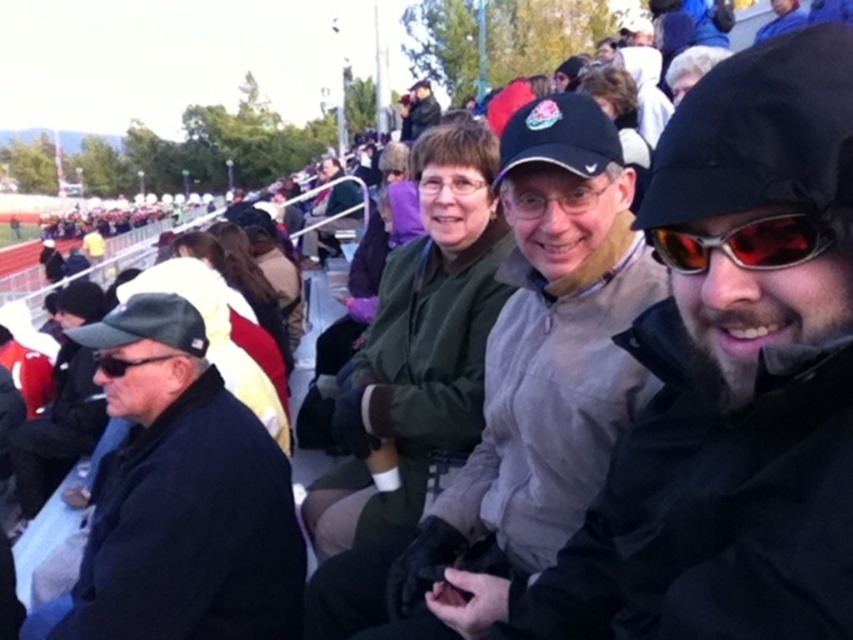
Question: Among these objects, which one is farthest from the camera?

Choices:
 (A) gray fleece jacket at center
 (B) shiny metallic goggles at center
 (C) black matte jacket at left
 (D) matte black glasses at center

Answer: (A)

Question: Can you confirm if gray fleece jacket at center is positioned to the right of black matte jacket at left?

Choices:
 (A) no
 (B) yes

Answer: (B)

Question: Is gray knit hat at center thinner than black matte sunglasses at left?

Choices:
 (A) yes
 (B) no

Answer: (B)

Question: Considering the real-world distances, which object is farthest from the gray knit hat at center?

Choices:
 (A) black matte jacket at left
 (B) gray fleece jacket at center
 (C) shiny metallic goggles at center

Answer: (B)

Question: Can you confirm if gray fleece jacket at center is positioned below matte black glasses at center?

Choices:
 (A) yes
 (B) no

Answer: (A)

Question: Which of these objects is positioned farthest from the matte black glasses at center?

Choices:
 (A) shiny metallic goggles at center
 (B) black matte jacket at left
 (C) gray fleece jacket at center
 (D) black matte sunglasses at left

Answer: (B)